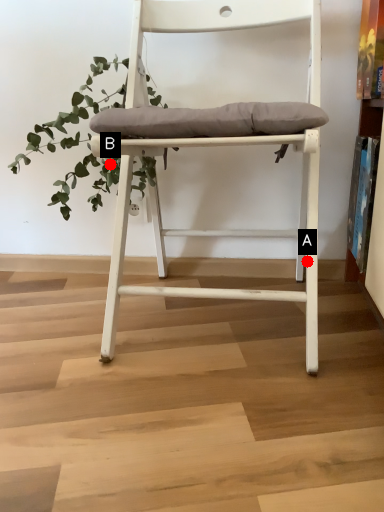
Question: Two points are circled on the image, labeled by A and B beside each circle. Which point is farther from the camera taking this photo?

Choices:
 (A) A is further
 (B) B is further

Answer: (B)